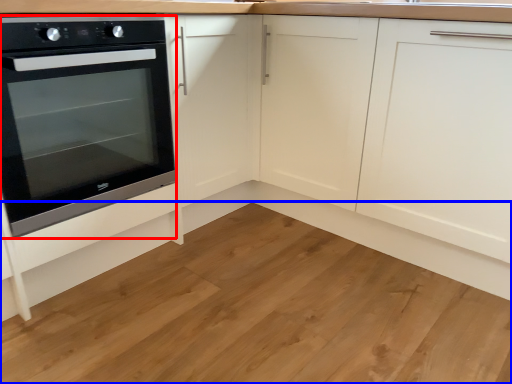
Question: Which of the following is the farthest to the observer, oven (highlighted by a red box) or hardwood (highlighted by a blue box)?

Choices:
 (A) oven
 (B) hardwood

Answer: (A)